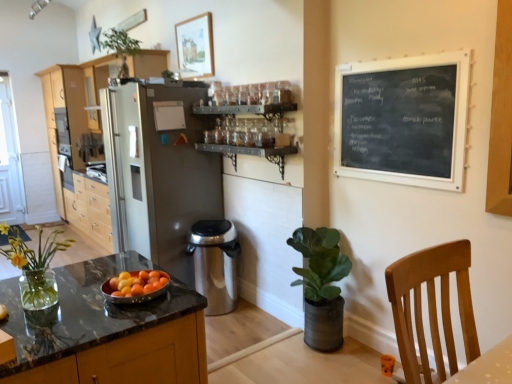
The width and height of the screenshot is (512, 384). What are the coordinates of `vacant space positioned to the left of green matte plant at lower right, which appears as the third houseplant when viewed from the top` in the screenshot? It's located at (270, 339).